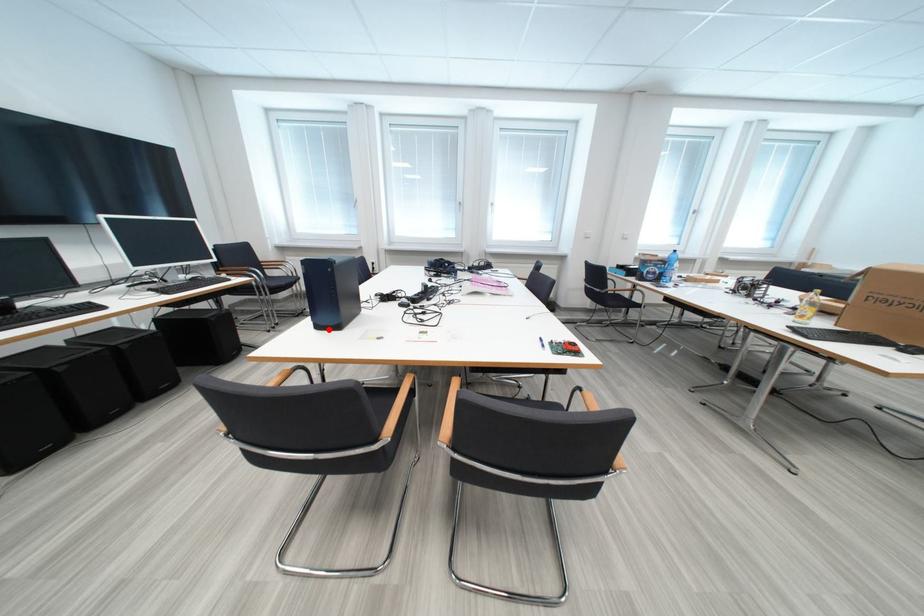
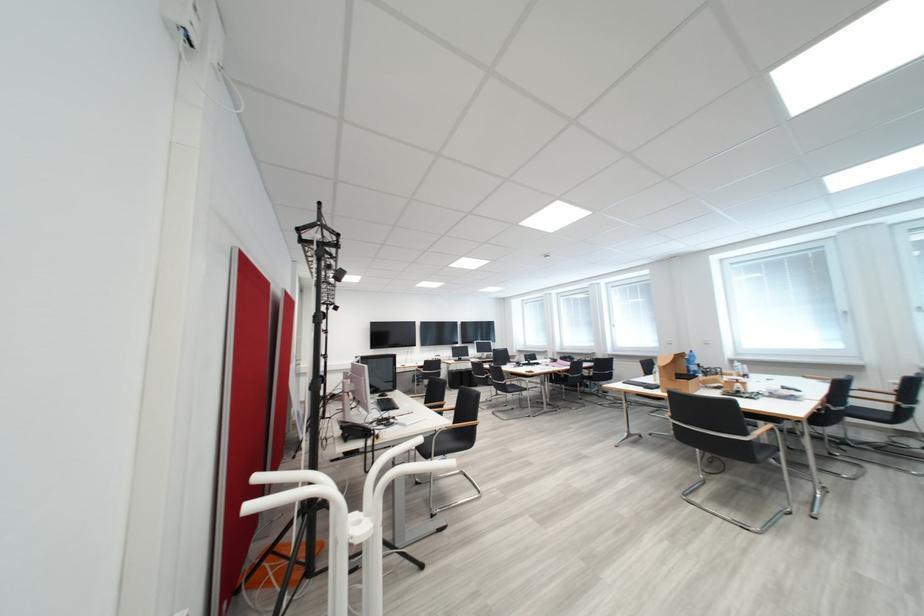
Question: I am providing you with two images of the same scene from different viewpoints. A red point is marked on the first image. Is the red point's position out of view in image 2?

Choices:
 (A) Yes
 (B) No

Answer: (A)